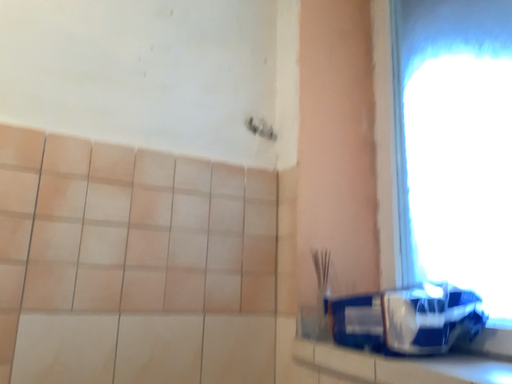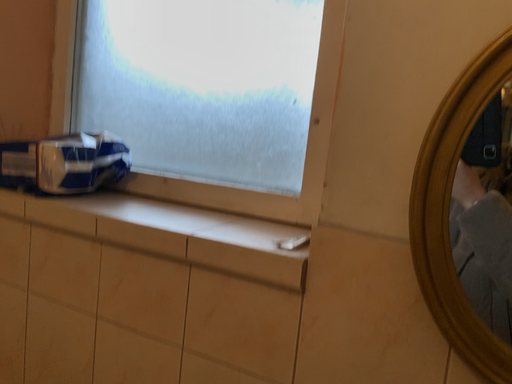
Question: Which way did the camera rotate in the video?

Choices:
 (A) rotated upward
 (B) rotated downward

Answer: (B)